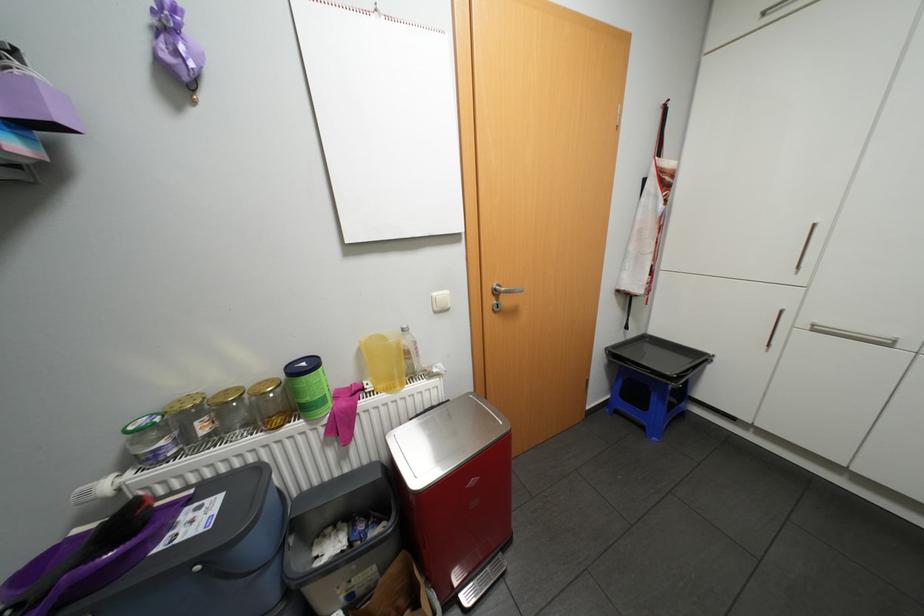
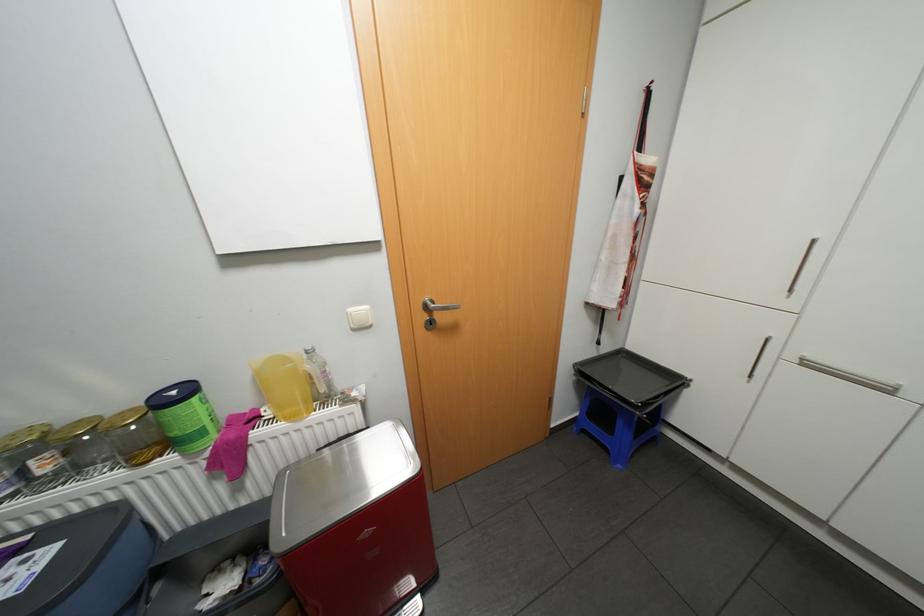
Where in the second image is the point corresponding to (624,411) from the first image?

(591, 431)